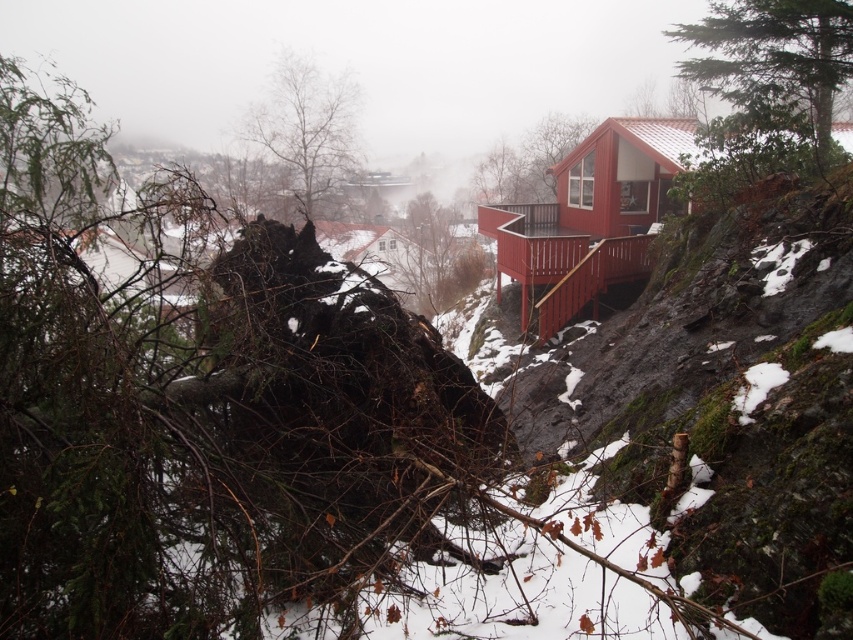
Question: Which of the following is the closest to the observer?

Choices:
 (A) smooth bark tree at upper center
 (B) brown wood tree at upper center

Answer: (A)

Question: Which point is closer to the camera?

Choices:
 (A) (802, 67)
 (B) (320, 152)
 (C) (355, 262)

Answer: (A)

Question: Is white wooden cabin at center positioned in front of brown wood tree at upper center?

Choices:
 (A) yes
 (B) no

Answer: (A)

Question: Is matte red cabin at center below white wooden cabin at center?

Choices:
 (A) no
 (B) yes

Answer: (A)

Question: Which point appears farthest from the camera in this image?

Choices:
 (A) (741, 1)
 (B) (347, 260)

Answer: (B)

Question: Can you confirm if matte red cabin at center is positioned above white wooden cabin at center?

Choices:
 (A) no
 (B) yes

Answer: (B)